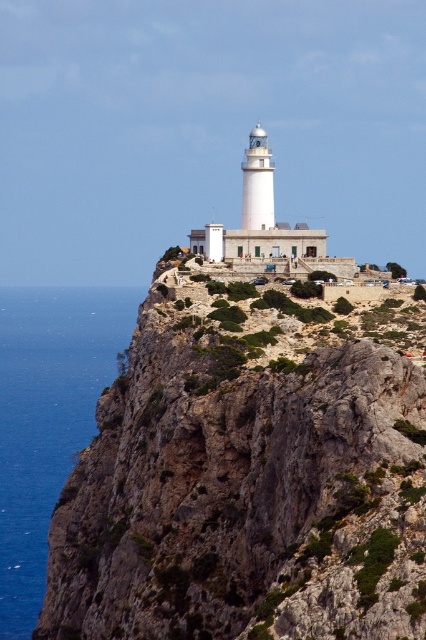
You are a drone operator trying to land a drone on the cliff face near the lighthouse. The drone has a GPS coordinate system where the bottom left corner of the cliff is point 0,0 and the top right corner is point 1,1. You need to place the drone precisely on the brown rough rock at upper center. What are the coordinates you should input into the drone to land it there?

The coordinates for the brown rough rock at upper center are (249, 474), so you should input those coordinates into the drone to land it there.

In the scene shown: You are a hiker who wants to cross from the cliff to the lighthouse. You see a brown rough rock at upper center and blue liquid water at left. Which path is wider for your passage?

The blue liquid water at left is wider than the brown rough rock at upper center, so the path over the blue liquid water at left is wider for your passage.

You are standing at the base of the cliff near the ocean and looking up at the lighthouse. There are two points marked on the cliff face. One is at coordinates point (331, 552) and the other is at point (0, 515). Which point is closer to you when you are at the base?

Point (0, 515) is closer to you because it is behind point (331, 552). Since you are at the base, the point further back would be nearer to your position.